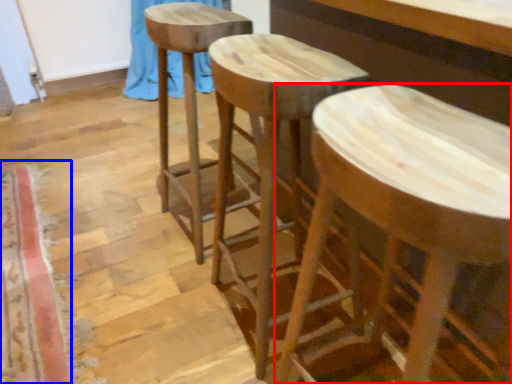
Question: Which of the following is the farthest to the observer, stool (highlighted by a red box) or mat (highlighted by a blue box)?

Choices:
 (A) stool
 (B) mat

Answer: (B)